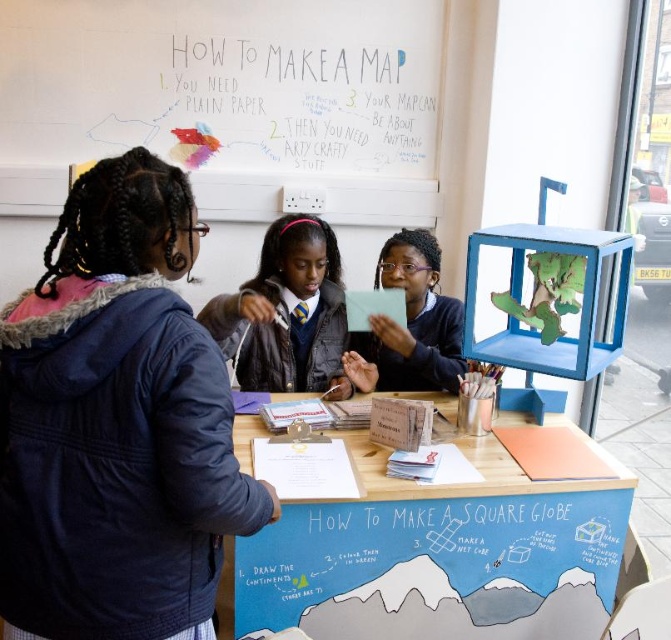
Question: Among these points, which one is nearest to the camera?

Choices:
 (A) (125, 520)
 (B) (460, 308)

Answer: (A)

Question: Which point is closer to the camera?

Choices:
 (A) wooden table at center
 (B) whiteboard at upper center

Answer: (A)

Question: Can you confirm if whiteboard at upper center is positioned above wooden table at center?

Choices:
 (A) yes
 (B) no

Answer: (A)

Question: Is wooden table at center to the left of matte black jacket at center from the viewer's perspective?

Choices:
 (A) no
 (B) yes

Answer: (A)

Question: Which is nearer to the navy blue jacket at left?

Choices:
 (A) whiteboard at upper center
 (B) matte black jacket at center
 (C) wooden table at center
 (D) matte black tablet at center

Answer: (C)

Question: Can you confirm if wooden table at center is wider than matte black tablet at center?

Choices:
 (A) yes
 (B) no

Answer: (A)